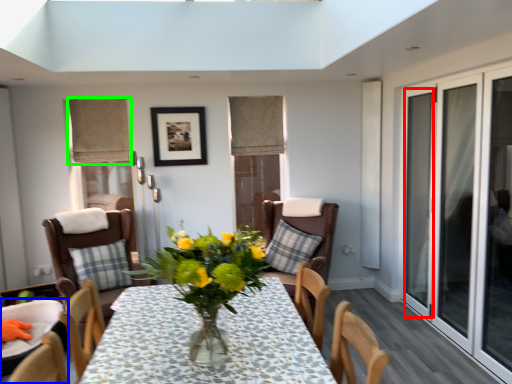
Question: Which is nearer to the glass door (highlighted by a red box)? chair (highlighted by a blue box) or curtain (highlighted by a green box).

Choices:
 (A) chair
 (B) curtain

Answer: (B)